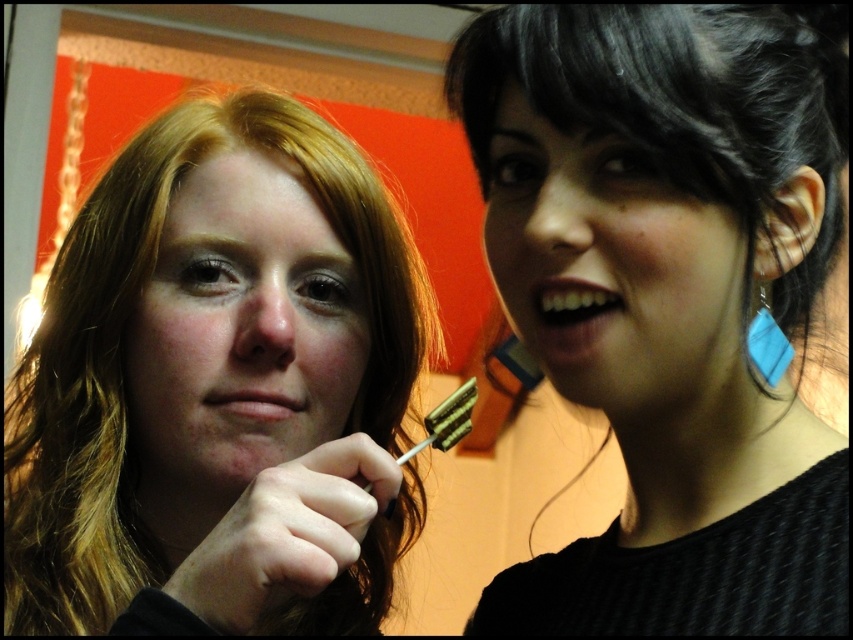
Who is shorter, matte skin face at center or matte black hair at upper right?

matte black hair at upper right

You are a GUI agent. You are given a task and a screenshot of the screen. Output one action in this format:
    pyautogui.click(x=<x>, y=<y>)
    Task: Click on the matte skin face at center
    
    Given the screenshot: What is the action you would take?
    pyautogui.click(x=242, y=326)

The width and height of the screenshot is (853, 640). I want to click on matte skin face at center, so click(x=242, y=326).

Which is more to the left, matte skin face at center or blue fabric earring at right?

Positioned to the left is matte skin face at center.

Which is above, matte skin face at center or blue fabric earring at right?

Positioned higher is blue fabric earring at right.

You are a GUI agent. You are given a task and a screenshot of the screen. Output one action in this format:
    pyautogui.click(x=<x>, y=<y>)
    Task: Click on the matte skin face at center
    The image size is (853, 640).
    Given the screenshot: What is the action you would take?
    pyautogui.click(x=242, y=326)

Is point (152, 445) closer to viewer compared to point (549, 280)?

No, it is behind (549, 280).

Between matte skin face at center and white glossy teeth at upper right, which one appears on the left side from the viewer's perspective?

matte skin face at center is more to the left.

Does point (206, 308) come farther from viewer compared to point (601, 314)?

Yes.

Locate an element on the screen. This screenshot has height=640, width=853. matte skin face at center is located at coordinates (242, 326).